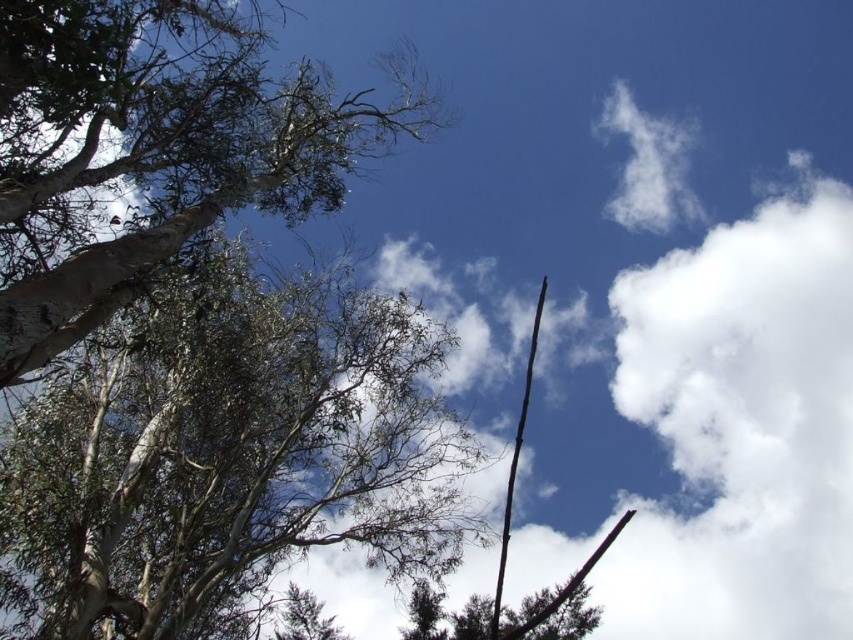
You are a bird looking for a place to perch. You see two trees in the upper left corner of the image. The green rough bark tree at upper left and the green leafy tree at upper left. Which tree is farther away from the other?

The green rough bark tree at upper left and green leafy tree at upper left are 3.94 meters apart, but the question is about which is farther away. Since both are in the same upper left corner, the distance between them doesn not indicate their distance from the observer. The answer cannot be determined from the given information.

You are standing under the trees looking up at the sky. There are two points marked in the image, one at coordinate point (44, 109) and the other at point (666, 228). Which point is nearer to you?

Point (44, 109) is closer to the viewer than point (666, 228).

You are an artist sketching the scene and want to draw the green rough bark tree at upper left and the white fluffy cloud at upper right. Which object should you draw first if you want to follow the natural left to right flow of the image?

You should draw the green rough bark tree at upper left first because it is positioned on the left side of the white fluffy cloud at upper right, following the left to right flow.